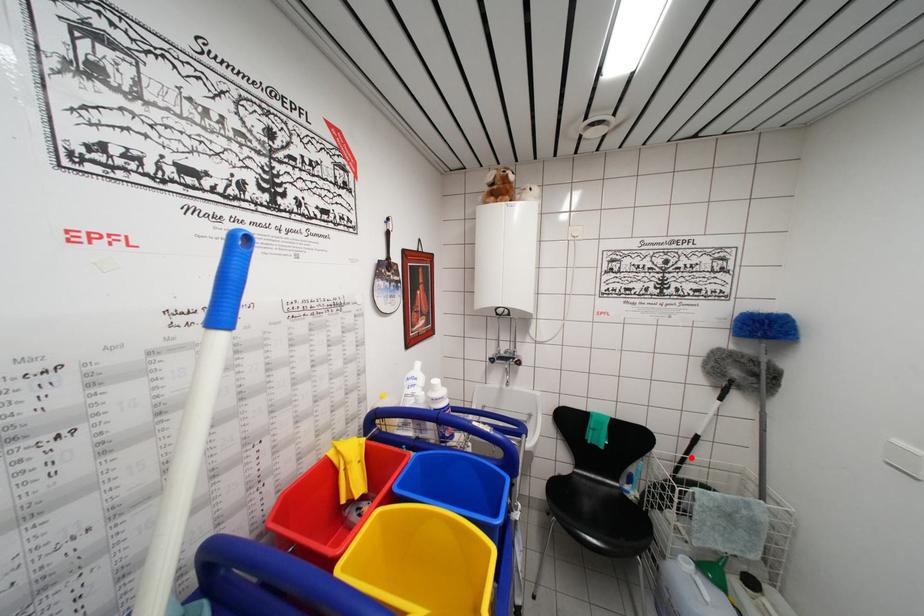
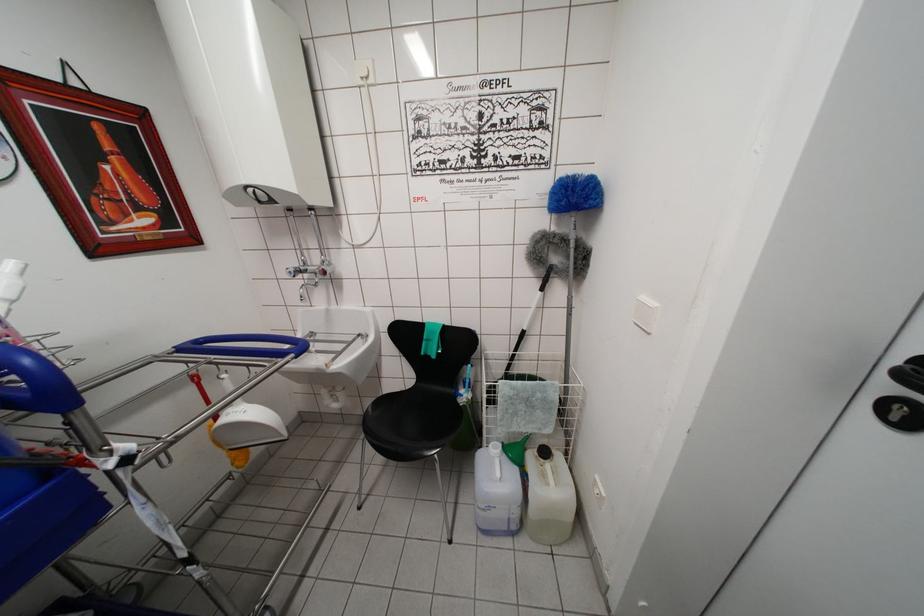
In the second image, find the point that corresponds to the highlighted location in the first image.

(518, 354)